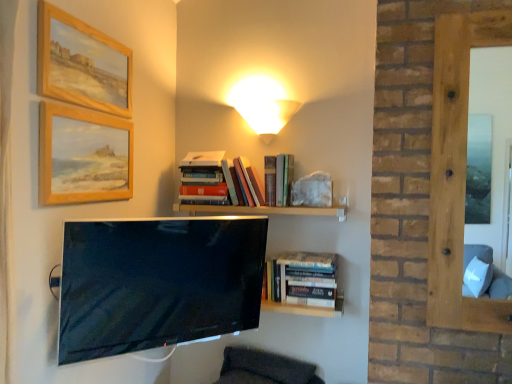
Where is `wooden painted picture frame at upper left, the second picture frame positioned from the top`? wooden painted picture frame at upper left, the second picture frame positioned from the top is located at coordinates (83, 156).

Describe the element at coordinates (203, 179) in the screenshot. I see `hardcover books at center, which is the 1th book in top-to-bottom order` at that location.

Image resolution: width=512 pixels, height=384 pixels. I want to click on matte yellow glass table lamp at upper center, so click(x=263, y=105).

Identify the location of wooden framed painting at upper left, which is the second picture frame from bottom to top. The width and height of the screenshot is (512, 384). (82, 64).

Describe the element at coordinates (457, 171) in the screenshot. I see `smooth wooden frame at right` at that location.

Find the location of a particular element. The width and height of the screenshot is (512, 384). smooth wooden frame at right is located at coordinates (457, 171).

Locate an element on the screen. This screenshot has width=512, height=384. hardcover books at upper center, which is the 2th book from bottom to top is located at coordinates (279, 179).

Measure the distance between point (278,189) and camera.

Point (278,189) is 6.36 feet away from camera.

Where is `wooden painted picture frame at upper left, the second picture frame positioned from the top`? wooden painted picture frame at upper left, the second picture frame positioned from the top is located at coordinates (83, 156).

From a real-world perspective, which is physically below, hardcover books at center, the 3th book when ordered from left to right, or matte yellow glass table lamp at upper center?

From a 3D spatial view, hardcover books at center, the 3th book when ordered from left to right, is below.

From the picture: In terms of width, does hardcover books at center, the 3th book when ordered from left to right, look wider or thinner when compared to matte yellow glass table lamp at upper center?

hardcover books at center, the 3th book when ordered from left to right, is wider than matte yellow glass table lamp at upper center.

From the image's perspective, is hardcover books at center, the first book in the bottom-to-top sequence, located above matte yellow glass table lamp at upper center?

No.

Is hardcover books at center, positioned as the 3th book in top-to-bottom order, next to matte yellow glass table lamp at upper center?

No, hardcover books at center, positioned as the 3th book in top-to-bottom order, is not making contact with matte yellow glass table lamp at upper center.

I want to click on television on the left of the hardcover books at center, the first book in the bottom-to-top sequence, so click(x=157, y=283).

Which object is further away from the camera, matte black tv at center or hardcover books at center, the 3th book when ordered from left to right?

hardcover books at center, the 3th book when ordered from left to right, is further away from the camera.

Based on the photo, from the image's perspective, which is above, matte black tv at center or hardcover books at center, which is counted as the first book, starting from the right?

matte black tv at center appears higher in the image.

What are the coordinates of `window to the right of dark gray fabric swivel chair at lower center` in the screenshot? It's located at (457, 171).

Considering their positions, is smooth wooden frame at right located in front of or behind dark gray fabric swivel chair at lower center?

smooth wooden frame at right is in front of dark gray fabric swivel chair at lower center.

Can you confirm if smooth wooden frame at right is shorter than dark gray fabric swivel chair at lower center?

In fact, smooth wooden frame at right may be taller than dark gray fabric swivel chair at lower center.

Between smooth wooden frame at right and dark gray fabric swivel chair at lower center, which one has smaller width?

Thinner between the two is smooth wooden frame at right.

Does smooth wooden frame at right lie behind wooden framed painting at upper left, which is the second picture frame from bottom to top?

Yes, the depth of smooth wooden frame at right is greater than that of wooden framed painting at upper left, which is the second picture frame from bottom to top.

From a real-world perspective, is smooth wooden frame at right under wooden framed painting at upper left, which is the second picture frame from bottom to top?

Yes, from a real-world perspective, smooth wooden frame at right is under wooden framed painting at upper left, which is the second picture frame from bottom to top.

From the image's perspective, relative to wooden framed painting at upper left, the first picture frame in the top-to-bottom sequence, is smooth wooden frame at right above or below?

Based on their image positions, smooth wooden frame at right is located beneath wooden framed painting at upper left, the first picture frame in the top-to-bottom sequence.

Is there a large distance between smooth wooden frame at right and wooden framed painting at upper left, the first picture frame in the top-to-bottom sequence?

Yes, smooth wooden frame at right and wooden framed painting at upper left, the first picture frame in the top-to-bottom sequence, are quite far apart.

Can you tell me how much matte black tv at center and wooden framed painting at upper left, which is the second picture frame from bottom to top, differ in facing direction?

They differ by 41.9 degrees in their facing directions.

From a real-world perspective, is matte black tv at center beneath wooden framed painting at upper left, which is the second picture frame from bottom to top?

Indeed, from a real-world perspective, matte black tv at center is positioned beneath wooden framed painting at upper left, which is the second picture frame from bottom to top.

Considering the points (69, 222) and (77, 64), which point is in front, point (69, 222) or point (77, 64)?

The point (69, 222) is in front.

Does matte black tv at center have a larger size compared to wooden framed painting at upper left, which is the second picture frame from bottom to top?

Yes, matte black tv at center is bigger than wooden framed painting at upper left, which is the second picture frame from bottom to top.

In the image, is dark gray fabric swivel chair at lower center positioned in front of or behind matte black tv at center?

dark gray fabric swivel chair at lower center is behind matte black tv at center.

Identify the location of swivel chair that appears below the matte black tv at center (from a real-world perspective). This screenshot has width=512, height=384. (264, 368).

Would you say dark gray fabric swivel chair at lower center is a long distance from matte black tv at center?

No.

Is dark gray fabric swivel chair at lower center oriented towards matte black tv at center?

No, dark gray fabric swivel chair at lower center is not facing towards matte black tv at center.

From the image's perspective, relative to dark gray fabric swivel chair at lower center, is wooden framed painting at upper left, which is the second picture frame from bottom to top, above or below?

wooden framed painting at upper left, which is the second picture frame from bottom to top, is above dark gray fabric swivel chair at lower center.

Which is more distant, (77, 93) or (252, 360)?

The point (252, 360) is farther from the camera.

Would you say wooden framed painting at upper left, the first picture frame in the top-to-bottom sequence, is inside or outside dark gray fabric swivel chair at lower center?

wooden framed painting at upper left, the first picture frame in the top-to-bottom sequence, is spatially situated outside dark gray fabric swivel chair at lower center.

You are a GUI agent. You are given a task and a screenshot of the screen. Output one action in this format:
    pyautogui.click(x=<x>, y=<y>)
    Task: Click on the table lamp that is behind the hardcover books at center, positioned as the 3th book in top-to-bottom order
    
    Given the screenshot: What is the action you would take?
    pyautogui.click(x=263, y=105)

Starting from the matte black tv at center, which book is the 3rd one to the right? Please provide its 2D coordinates.

[(304, 284)]

Considering their positions, is hardcover books at center, positioned as the 3th book in top-to-bottom order, positioned closer to wooden painted picture frame at upper left, arranged as the 1th picture frame when ordered from the bottom, than hardcover books at center, the third book from the bottom?

Among the two, hardcover books at center, the third book from the bottom, is located nearer to wooden painted picture frame at upper left, arranged as the 1th picture frame when ordered from the bottom.

Which object lies nearer to the anchor point matte yellow glass table lamp at upper center, matte black tv at center or wooden framed painting at upper left, the first picture frame in the top-to-bottom sequence?

wooden framed painting at upper left, the first picture frame in the top-to-bottom sequence.

Consider the image. Based on their spatial positions, is hardcover books at center, the first book in the bottom-to-top sequence, or wooden framed painting at upper left, which is the second picture frame from bottom to top, closer to smooth wooden frame at right?

Among the two, hardcover books at center, the first book in the bottom-to-top sequence, is located nearer to smooth wooden frame at right.

When comparing their distances from wooden at upper center, does hardcover books at upper center, the second book positioned from the left, or wooden framed painting at upper left, which is the second picture frame from bottom to top, seem further?

Based on the image, wooden framed painting at upper left, which is the second picture frame from bottom to top, appears to be further to wooden at upper center.

From the image, which object appears to be farther from hardcover books at center, positioned as the 3th book in top-to-bottom order, hardcover books at center, arranged as the 1th book when viewed from the left, or matte yellow glass table lamp at upper center?

matte yellow glass table lamp at upper center lies further to hardcover books at center, positioned as the 3th book in top-to-bottom order, than the other object.

When comparing their distances from wooden at upper center, does hardcover books at upper center, acting as the second book starting from the right, or wooden painted picture frame at upper left, arranged as the 1th picture frame when ordered from the bottom, seem closer?

hardcover books at upper center, acting as the second book starting from the right, is positioned closer to the anchor wooden at upper center.

Considering their positions, is wooden framed painting at upper left, the first picture frame in the top-to-bottom sequence, positioned further to matte yellow glass table lamp at upper center than smooth wooden frame at right?

smooth wooden frame at right.

Estimate the real-world distances between objects in this image. Which object is closer to hardcover books at center, the third book from the bottom, hardcover books at upper center, acting as the second book starting from the right, or wooden painted picture frame at upper left, the second picture frame positioned from the top?

The object closer to hardcover books at center, the third book from the bottom, is hardcover books at upper center, acting as the second book starting from the right.

Identify the location of window that lies between hardcover books at center, the third book when ordered from right to left, and dark gray fabric swivel chair at lower center from top to bottom. (457, 171).

Where is `television between wooden painted picture frame at upper left, arranged as the 1th picture frame when ordered from the bottom, and hardcover books at center, positioned as the 3th book in top-to-bottom order`? television between wooden painted picture frame at upper left, arranged as the 1th picture frame when ordered from the bottom, and hardcover books at center, positioned as the 3th book in top-to-bottom order is located at coordinates (157, 283).

Locate an element on the screen. This screenshot has width=512, height=384. shelf between matte yellow glass table lamp at upper center and matte black tv at center from top to bottom is located at coordinates (264, 210).

The image size is (512, 384). What are the coordinates of `picture frame between matte yellow glass table lamp at upper center and dark gray fabric swivel chair at lower center vertically` in the screenshot? It's located at (83, 156).